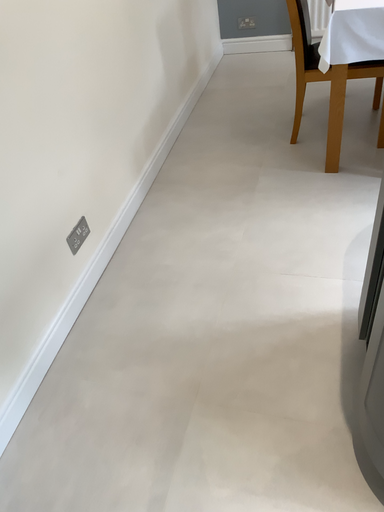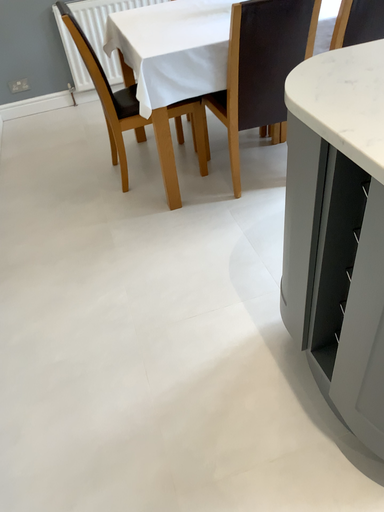
Question: How did the camera likely rotate when shooting the video?

Choices:
 (A) rotated left
 (B) rotated right

Answer: (B)